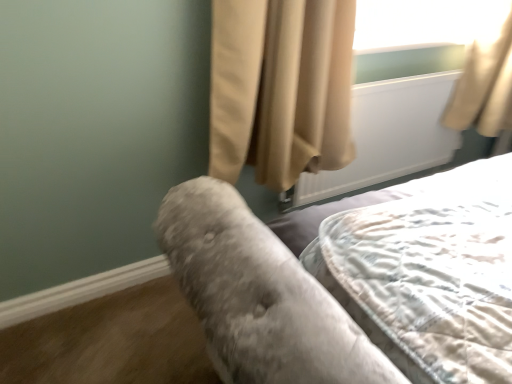
Find the location of a particular element. beige fabric radiator at upper right is located at coordinates (389, 135).

Image resolution: width=512 pixels, height=384 pixels. What do you see at coordinates (389, 135) in the screenshot?
I see `beige fabric radiator at upper right` at bounding box center [389, 135].

Identify the location of beige fabric radiator at upper right. (389, 135).